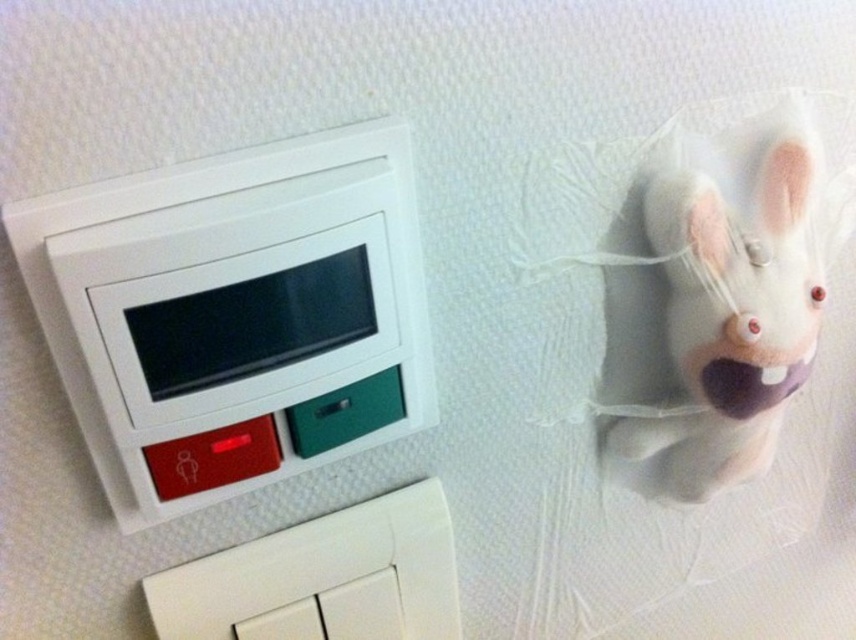
Question: Is white plastic light switch at upper left below white plastic switch at lower left?

Choices:
 (A) no
 (B) yes

Answer: (A)

Question: Which object is the closest to the white felt rabbit at upper right?

Choices:
 (A) white plastic switch at lower left
 (B) white plastic light switch at upper left

Answer: (B)

Question: Among these points, which one is nearest to the camera?

Choices:
 (A) (348, 227)
 (B) (724, 472)

Answer: (A)

Question: Does white plastic light switch at upper left appear on the right side of white felt rabbit at upper right?

Choices:
 (A) no
 (B) yes

Answer: (A)

Question: Is white plastic light switch at upper left thinner than white plastic switch at lower left?

Choices:
 (A) yes
 (B) no

Answer: (A)

Question: Considering the real-world distances, which object is closest to the white plastic light switch at upper left?

Choices:
 (A) white felt rabbit at upper right
 (B) white plastic switch at lower left

Answer: (B)